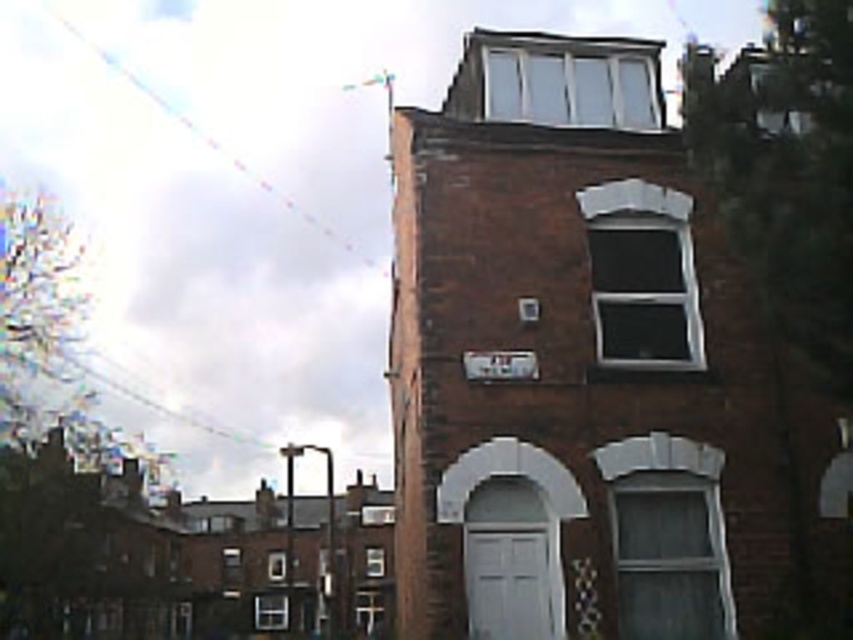
You are standing in front of the brick building and want to locate the point at coordinates (590, 372). Based on the scene description, where would this point be located?

The point at coordinates (590, 372) is on the brown brick building at center.

You are standing in front of the brick building and want to determine the relative positions of two points marked on the facade. Which of the two points, point (624, 435) or point (318, 228), is closer to you?

Point (624, 435) is closer to the viewer than point (318, 228).